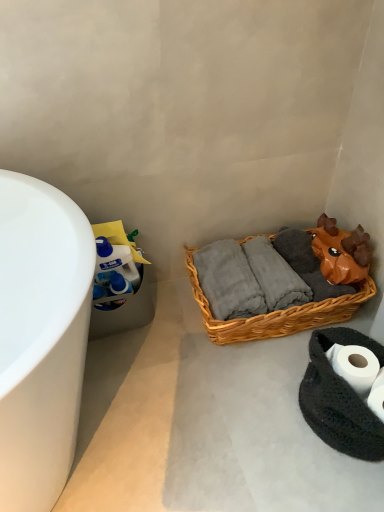
The width and height of the screenshot is (384, 512). Find the location of `free location to the left of woven brown basket at center`. free location to the left of woven brown basket at center is located at coordinates (164, 348).